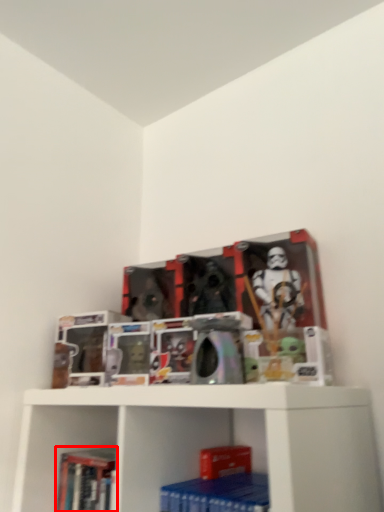
Question: Observing the image, what is the correct spatial positioning of book (annotated by the red box) in reference to paperback book?

Choices:
 (A) right
 (B) left

Answer: (B)